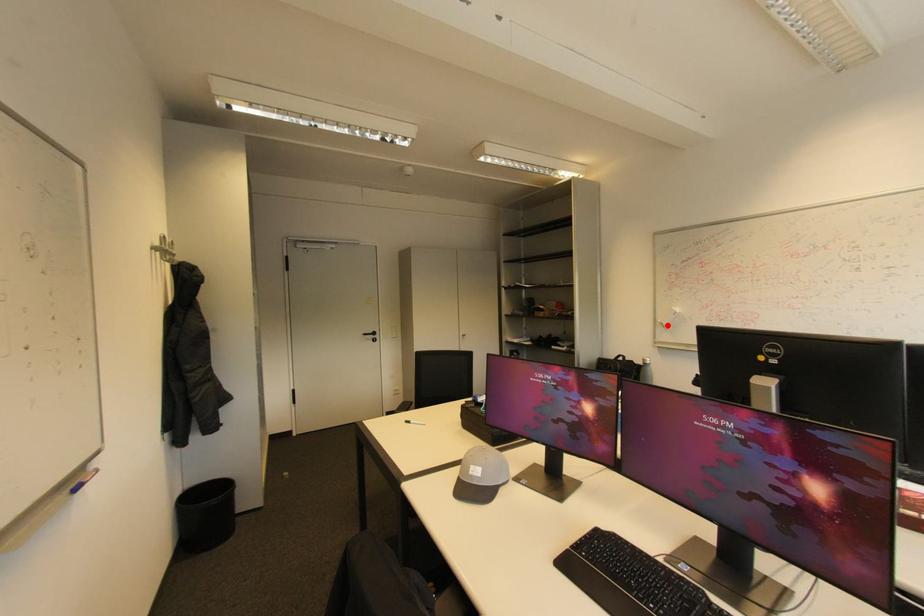
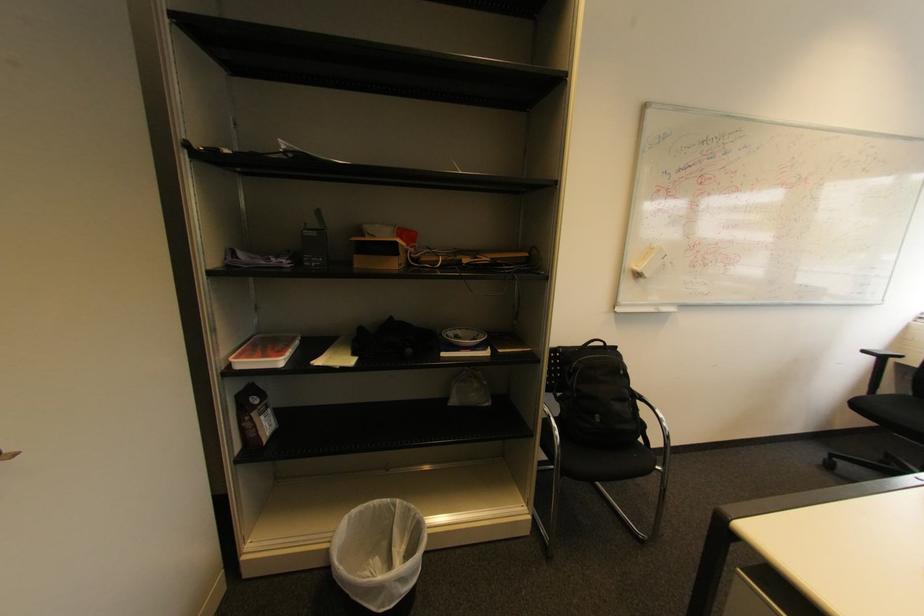
The point at the highlighted location is marked in the first image. Where is the corresponding point in the second image?

(643, 276)